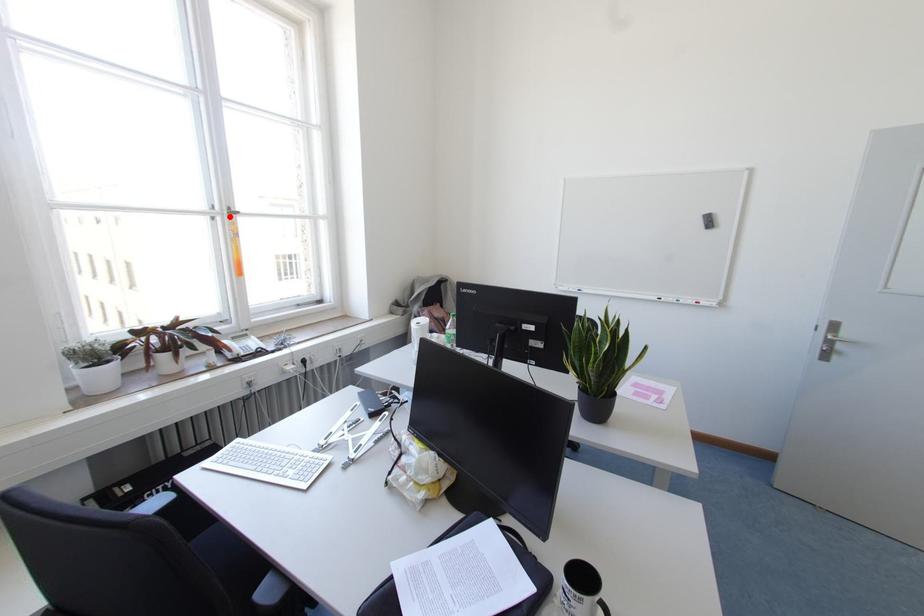
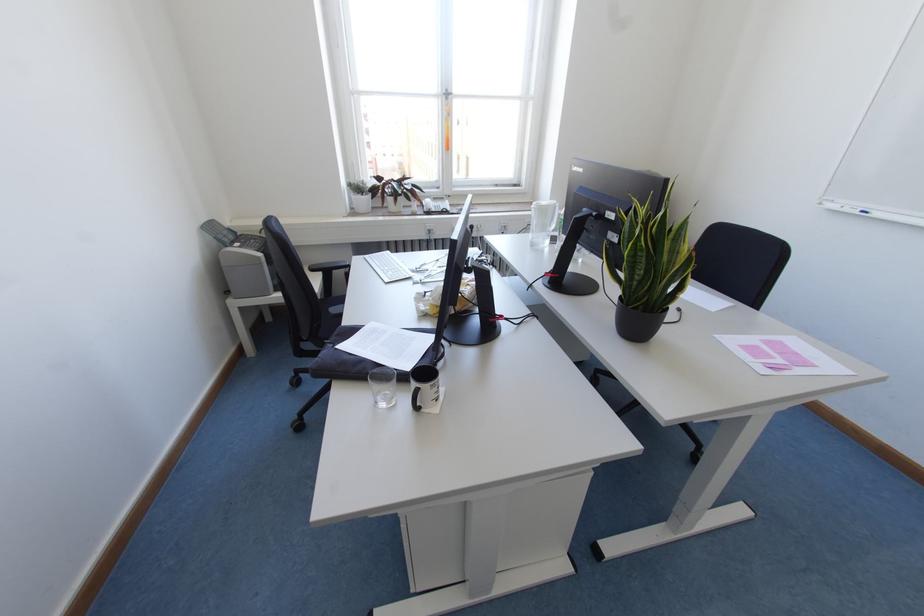
Question: I am providing you with two images of the same scene from different viewpoints. Image1 has a red point marked. In image2, the corresponding 3D location appears at what relative position? Reply with the corresponding letter.

Choices:
 (A) Closer
 (B) Farther

Answer: (A)